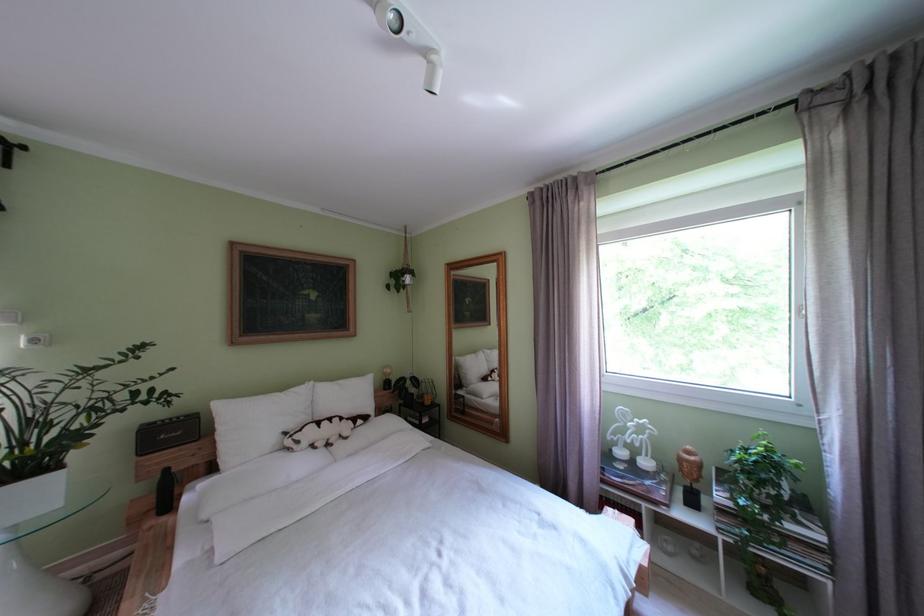
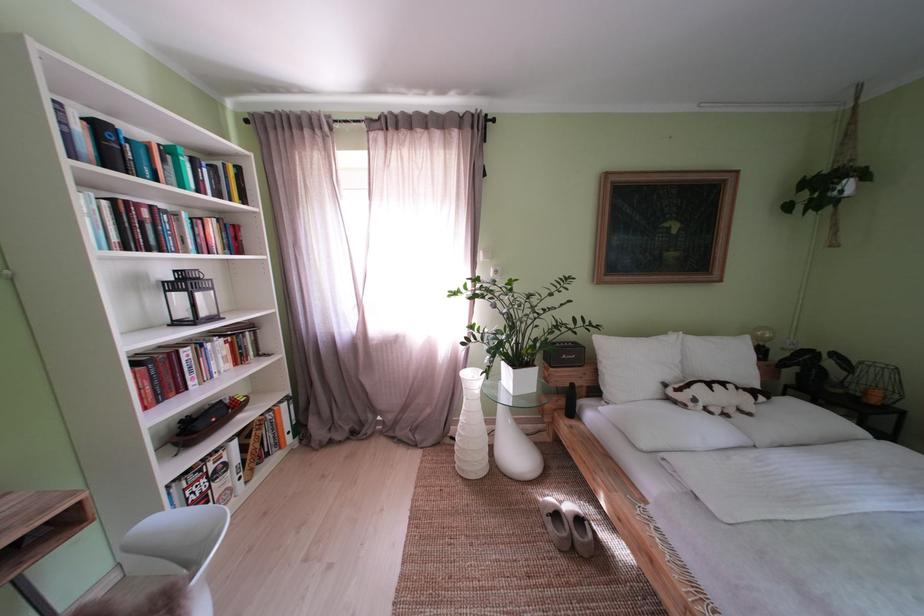
Find the pixel in the second image that matches point 351,387 in the first image.

(723, 344)